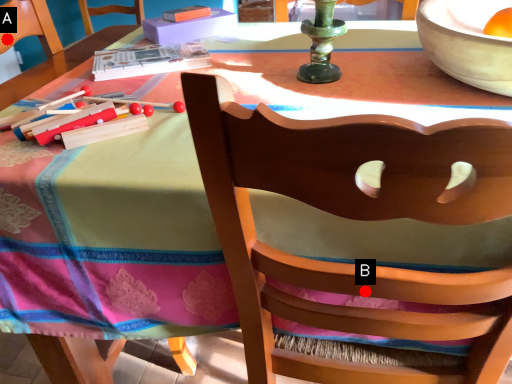
Question: Two points are circled on the image, labeled by A and B beside each circle. Which point is further to the camera?

Choices:
 (A) A is further
 (B) B is further

Answer: (A)